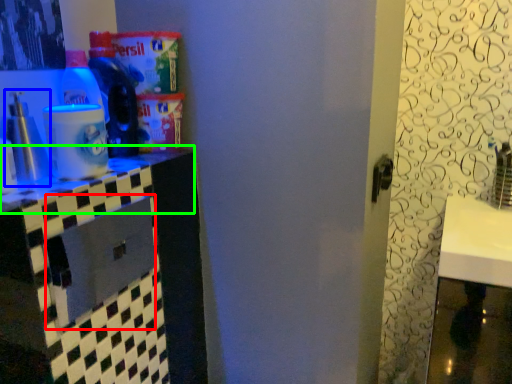
Question: Which object is the farthest from drawer (highlighted by a red box)? Choose among these: bottle (highlighted by a blue box) or counter top (highlighted by a green box).

Choices:
 (A) bottle
 (B) counter top

Answer: (A)